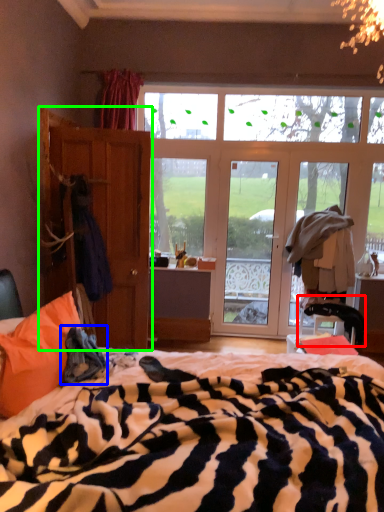
Question: Estimate the real-world distances between objects in this image. Which object is farther from swivel chair (highlighted by a red box), cloth (highlighted by a blue box) or armoire (highlighted by a green box)?

Choices:
 (A) cloth
 (B) armoire

Answer: (A)